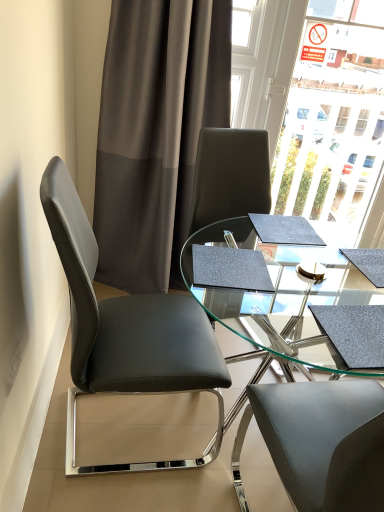
The image size is (384, 512). Identify the location of transparent glass table at center. (318, 419).

Is point (198, 365) closer or farther from the camera than point (366, 324)?

Point (198, 365) appears to be farther away from the viewer than point (366, 324).

How many degrees apart are the facing directions of black leather chair at left and transparent glass table at center?

black leather chair at left and transparent glass table at center are facing 2.48 degrees away from each other.

Consider the image. Is black leather chair at left outside of transparent glass table at center?

Yes, black leather chair at left is not within transparent glass table at center.

Based on the photo, from the image's perspective, between black leather chair at left and transparent glass table at center, who is located below?

From the image's view, transparent glass table at center is below.

How much distance is there between dark grey sheer curtain at upper left and black leather chair at left?

dark grey sheer curtain at upper left is 34.46 inches from black leather chair at left.

Which object is positioned more to the left, dark grey sheer curtain at upper left or black leather chair at left?

black leather chair at left.

Looking at this image, who is taller, dark grey sheer curtain at upper left or black leather chair at left?

dark grey sheer curtain at upper left.

Which is correct: dark grey sheer curtain at upper left is inside black leather chair at left, or outside of it?

dark grey sheer curtain at upper left exists outside the volume of black leather chair at left.

Is transparent glass table at center closer to the viewer compared to black leather chair at left?

No, the depth of transparent glass table at center is greater than that of black leather chair at left.

Where is `table located on the right of black leather chair at left`? table located on the right of black leather chair at left is located at coordinates (318, 419).

From the image's perspective, between transparent glass table at center and black leather chair at left, who is located below?

transparent glass table at center appears lower in the image.

Considering the positions of objects transparent glass table at center and black leather chair at left in the image provided, who is more to the right, transparent glass table at center or black leather chair at left?

transparent glass table at center is more to the right.

Can you tell me how much dark grey sheer curtain at upper left and transparent glass table at center differ in facing direction?

94.8 degrees separate the facing orientations of dark grey sheer curtain at upper left and transparent glass table at center.

Which is farther from the camera, (x=104, y=207) or (x=368, y=334)?

The point (x=104, y=207) is farther from the camera.

From the image's perspective, is dark grey sheer curtain at upper left above or below transparent glass table at center?

Clearly, from the image's perspective, dark grey sheer curtain at upper left is above transparent glass table at center.

From a real-world perspective, who is located higher, dark grey sheer curtain at upper left or transparent glass table at center?

dark grey sheer curtain at upper left.

Considering the relative sizes of black leather chair at left and dark grey sheer curtain at upper left in the image provided, is black leather chair at left bigger than dark grey sheer curtain at upper left?

Incorrect, black leather chair at left is not larger than dark grey sheer curtain at upper left.

Which object is closer to the camera, black leather chair at left or dark grey sheer curtain at upper left?

black leather chair at left.

There is a black leather chair at left. Where is `curtain above it (from a real-world perspective)`? curtain above it (from a real-world perspective) is located at coordinates (156, 133).

From a real-world perspective, is black leather chair at left under dark grey sheer curtain at upper left?

Correct, in the physical world, black leather chair at left is lower than dark grey sheer curtain at upper left.

Can you confirm if transparent glass table at center is taller than dark grey sheer curtain at upper left?

No.

From the image's perspective, which object appears higher, transparent glass table at center or dark grey sheer curtain at upper left?

From the image's view, dark grey sheer curtain at upper left is above.

How much distance is there between transparent glass table at center and dark grey sheer curtain at upper left?

They are 1.01 meters apart.

Is transparent glass table at center closer to the viewer compared to dark grey sheer curtain at upper left?

Yes, the depth of transparent glass table at center is less than that of dark grey sheer curtain at upper left.

At what (x,y) coordinates should I click in order to perform the action: click on chair in front of the transparent glass table at center. Please return your answer as a coordinate pair (x, y). The image size is (384, 512). Looking at the image, I should click on (126, 331).

At what (x,y) coordinates should I click in order to perform the action: click on curtain above the black leather chair at left (from the image's perspective). Please return your answer as a coordinate pair (x, y). Image resolution: width=384 pixels, height=512 pixels. Looking at the image, I should click on (156, 133).

From the image, which object appears to be farther from transparent glass table at center, dark grey sheer curtain at upper left or black leather chair at left?

dark grey sheer curtain at upper left lies further to transparent glass table at center than the other object.

From the image, which object appears to be nearer to black leather chair at left, dark grey sheer curtain at upper left or transparent glass table at center?

The object closer to black leather chair at left is transparent glass table at center.

Considering their positions, is transparent glass table at center positioned closer to black leather chair at left than dark grey sheer curtain at upper left?

transparent glass table at center is closer to black leather chair at left.

Considering their positions, is black leather chair at left positioned closer to dark grey sheer curtain at upper left than transparent glass table at center?

black leather chair at left lies closer to dark grey sheer curtain at upper left than the other object.

Which object lies further to the anchor point dark grey sheer curtain at upper left, transparent glass table at center or black leather chair at left?

transparent glass table at center is further to dark grey sheer curtain at upper left.

From the image, which object appears to be farther from transparent glass table at center, black leather chair at left or dark grey sheer curtain at upper left?

dark grey sheer curtain at upper left is positioned further to the anchor transparent glass table at center.

Locate an element on the screen. chair between dark grey sheer curtain at upper left and transparent glass table at center in the vertical direction is located at coordinates (126, 331).